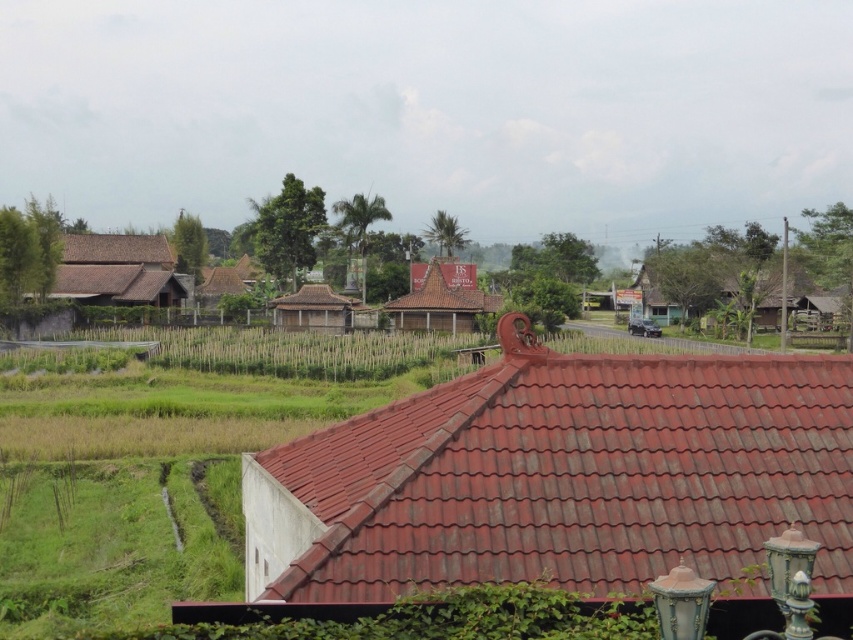
Does red tile roof at center appear under brown wooden hut at center?

Indeed, red tile roof at center is positioned under brown wooden hut at center.

Can you confirm if red tile roof at center is wider than brown wooden hut at center?

No.

This screenshot has height=640, width=853. What do you see at coordinates (560, 477) in the screenshot?
I see `red tile roof at center` at bounding box center [560, 477].

This screenshot has height=640, width=853. What are the coordinates of `red tile roof at center` in the screenshot? It's located at (560, 477).

Which is behind, point (494, 300) or point (126, 241)?

The point (126, 241) is behind.

Who is positioned more to the right, brown textured hut at center or brown tile roof at left?

brown textured hut at center

Describe the element at coordinates (440, 301) in the screenshot. I see `brown textured hut at center` at that location.

Image resolution: width=853 pixels, height=640 pixels. Find the location of `brown textured hut at center`. brown textured hut at center is located at coordinates (440, 301).

Does point (764, 404) come farther from viewer compared to point (437, 298)?

That is False.

How distant is red tile roof at center from brown textured hut at center?

red tile roof at center is 78.76 meters away from brown textured hut at center.

Is point (276, 486) more distant than point (416, 289)?

No, it is not.

This screenshot has height=640, width=853. What are the coordinates of `red tile roof at center` in the screenshot? It's located at (560, 477).